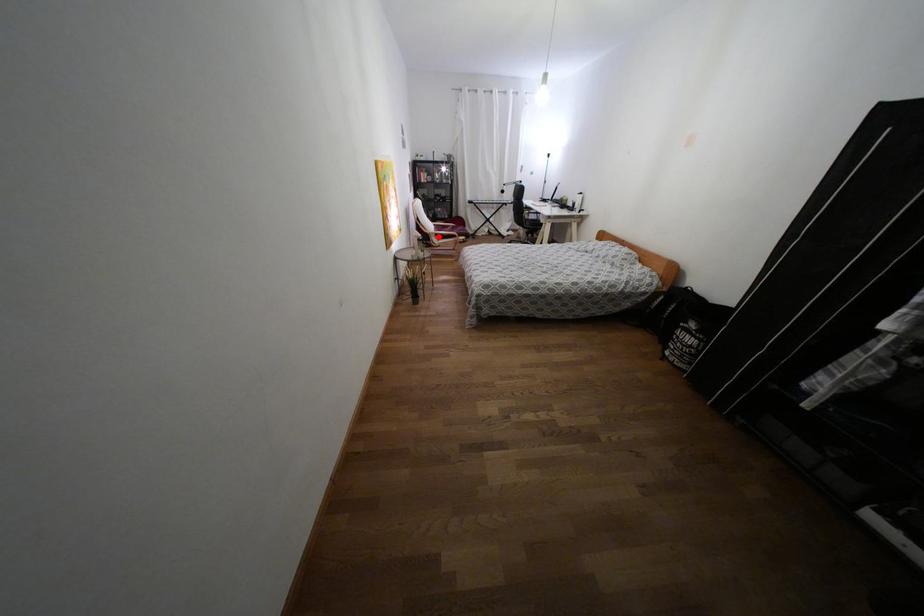
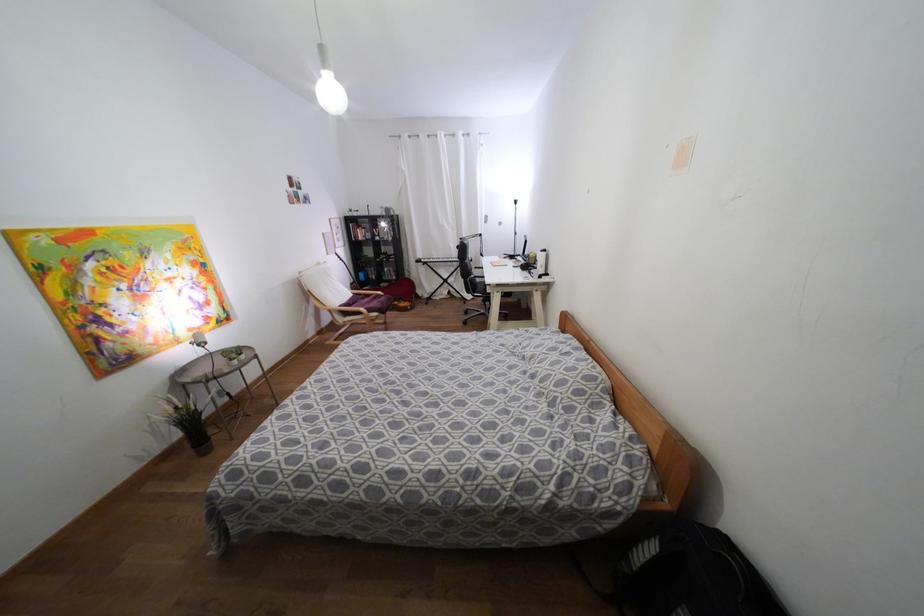
Question: I am providing you with two images of the same scene from different viewpoints. A red point is shown in image1. For the corresponding object point in image2, is it positioned nearer or farther from the camera?

Choices:
 (A) Nearer
 (B) Farther

Answer: (B)